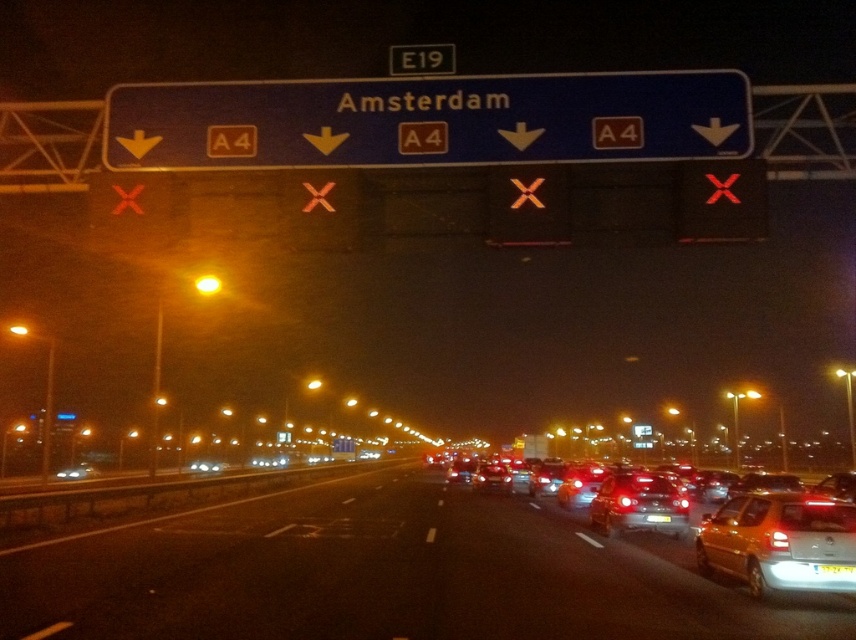
Who is taller, matte silver car at center or white plastic license plate at center?

matte silver car at center is taller.

Is point (770, 506) farther from camera compared to point (824, 566)?

Yes, it is behind point (824, 566).

Where is `matte silver car at center`? matte silver car at center is located at coordinates (733, 532).

Between point (544, 93) and point (821, 572), which one is positioned behind?

Point (544, 93)

Does point (646, 81) come farther from viewer compared to point (823, 572)?

That is True.

Does point (128, 125) come closer to viewer compared to point (818, 564)?

No, (128, 125) is behind (818, 564).

The width and height of the screenshot is (856, 640). I want to click on blue plastic sign at upper center, so click(429, 120).

Can you confirm if matte silver car at center is shorter than yellow matte car at lower right?

Incorrect, matte silver car at center's height does not fall short of yellow matte car at lower right's.

This screenshot has height=640, width=856. Describe the element at coordinates (733, 532) in the screenshot. I see `matte silver car at center` at that location.

The image size is (856, 640). What are the coordinates of `matte silver car at center` in the screenshot? It's located at (733, 532).